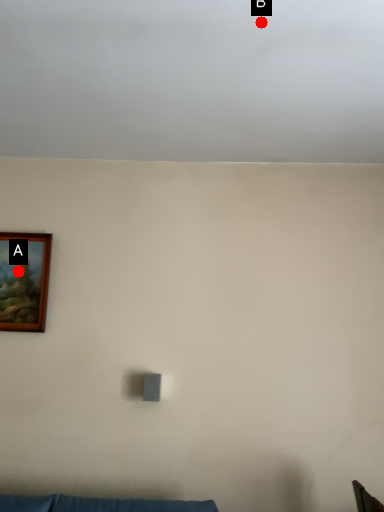
Question: Two points are circled on the image, labeled by A and B beside each circle. Which point is further to the camera?

Choices:
 (A) A is further
 (B) B is further

Answer: (A)